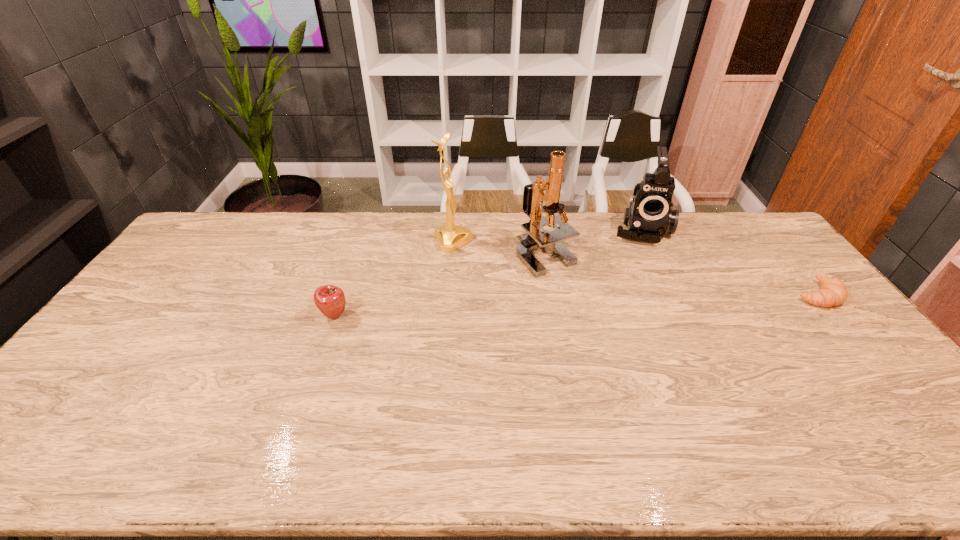
The image size is (960, 540). Find the location of `the leftmost object`. the leftmost object is located at coordinates (330, 300).

Find the location of a particular element. Image resolution: width=960 pixels, height=540 pixels. apple is located at coordinates (330, 300).

Locate an element on the screen. The height and width of the screenshot is (540, 960). crescent roll is located at coordinates (833, 292).

Locate an element on the screen. The image size is (960, 540). the shortest object is located at coordinates (833, 292).

Image resolution: width=960 pixels, height=540 pixels. I want to click on microscope, so click(536, 238).

Locate an element on the screen. the fourth object from right to left is located at coordinates (450, 237).

Identify the location of camcorder. (649, 217).

Find the location of a particular element. The width and height of the screenshot is (960, 540). the third tallest object is located at coordinates (649, 217).

Find the location of a particular element. The image size is (960, 540). vacant position located on the right of the apple is located at coordinates (366, 316).

Find the location of a particular element. The height and width of the screenshot is (540, 960). vacant point located 0.210m on the back of the shortest object is located at coordinates (772, 241).